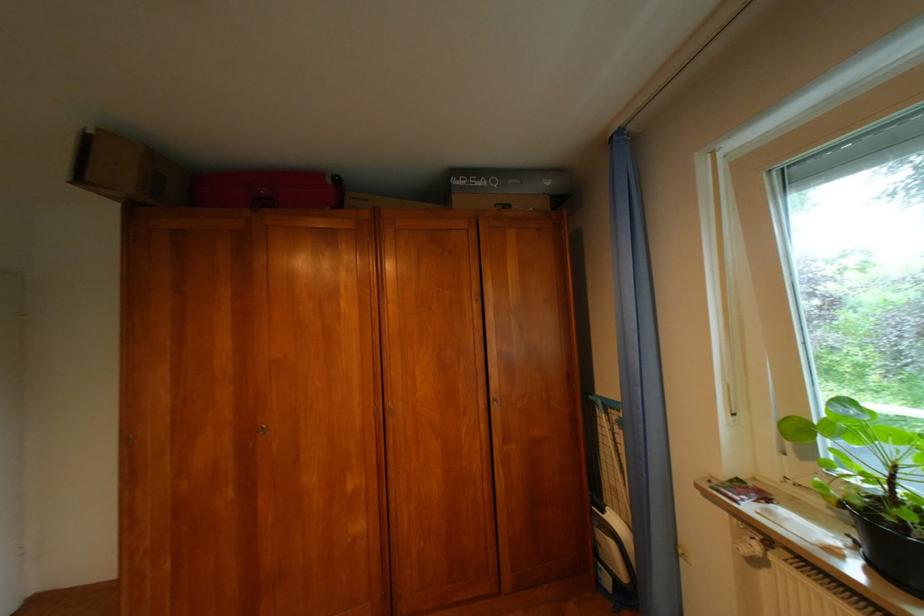
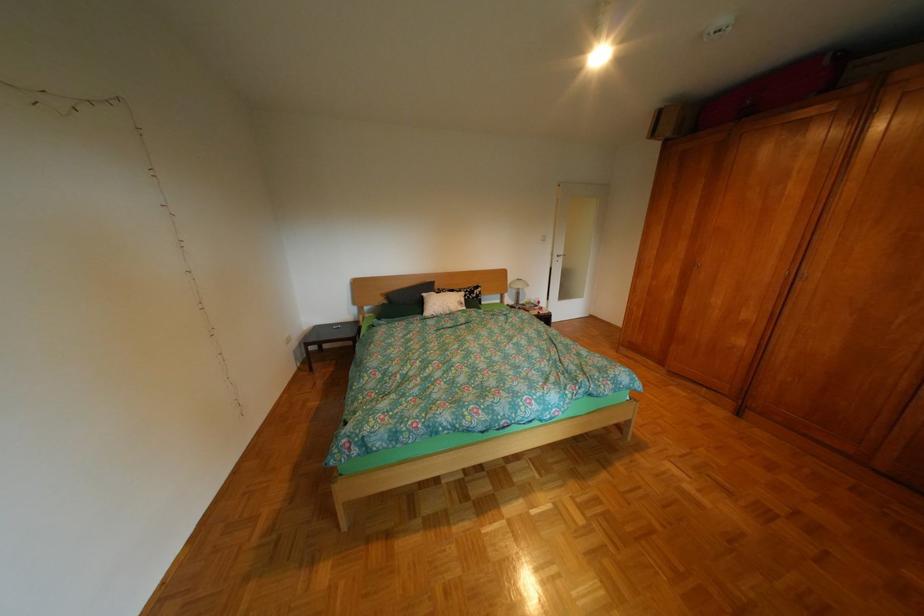
In the second image, find the point that corresponds to (x=343, y=180) in the first image.

(842, 63)